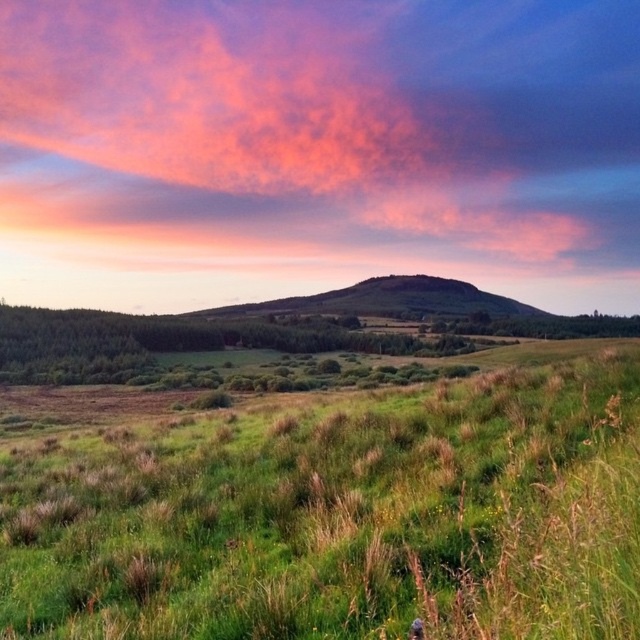
Measure the distance between point (x=400, y=90) and camera.

272.14 meters

Does pink fluffy cloud at upper center have a lesser height compared to green grassy hillside at center?

No.

Locate an element on the screen. The width and height of the screenshot is (640, 640). pink fluffy cloud at upper center is located at coordinates click(288, 129).

From the picture: Does green grassy field at center come behind pink fluffy cloud at upper center?

No, green grassy field at center is closer to the viewer.

Which is in front, point (136, 529) or point (349, 140)?

Point (136, 529)

Between point (125, 456) and point (467, 227), which one is positioned behind?

Positioned behind is point (467, 227).

Find the location of `green grassy field at center`. green grassy field at center is located at coordinates (340, 516).

Who is positioned more to the right, green grassy field at center or green grassy hillside at center?

green grassy hillside at center is more to the right.

This screenshot has width=640, height=640. What do you see at coordinates (340, 516) in the screenshot? I see `green grassy field at center` at bounding box center [340, 516].

Measure the distance between green grassy field at center and camera.

green grassy field at center and camera are 6.66 feet apart from each other.

This screenshot has width=640, height=640. In order to click on green grassy field at center in this screenshot , I will do `click(340, 516)`.